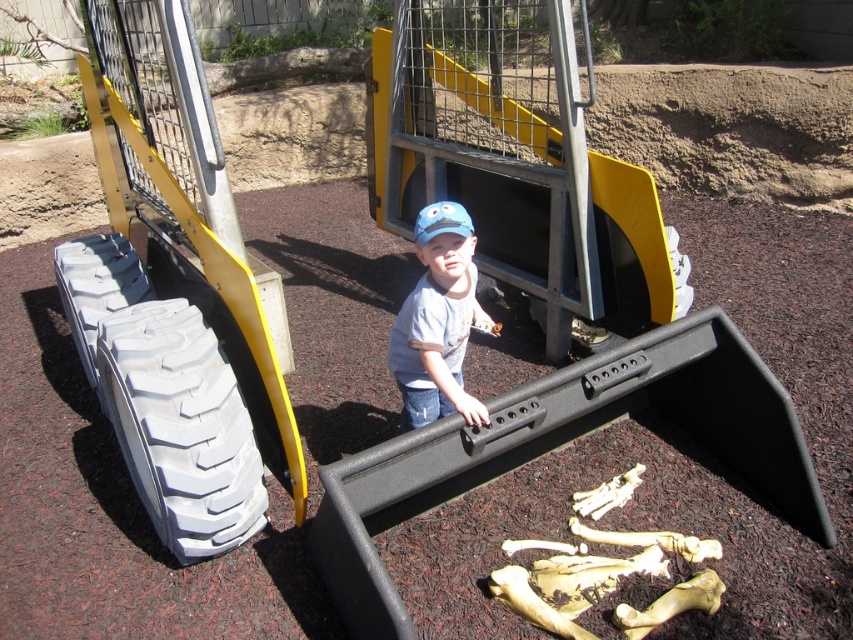
You are a photographer trying to capture a photo of the matte blue cap at center and the gray rubber tire at lower left. Based on their heights, which object should you focus on first if you want to ensure both are in frame without moving the camera?

The matte blue cap at center is taller than the gray rubber tire at lower left, so you should focus on the matte blue cap at center first to ensure both are in frame without moving the camera.

You are a parent trying to ensure safety in the play area. You notice the matte blue cap at center and the gray rubber tire at lower left. Which object is smaller and needs to be picked up first to prevent a child from slipping?

The matte blue cap at center is smaller than the gray rubber tire at lower left, so it should be picked up first to prevent a child from slipping.